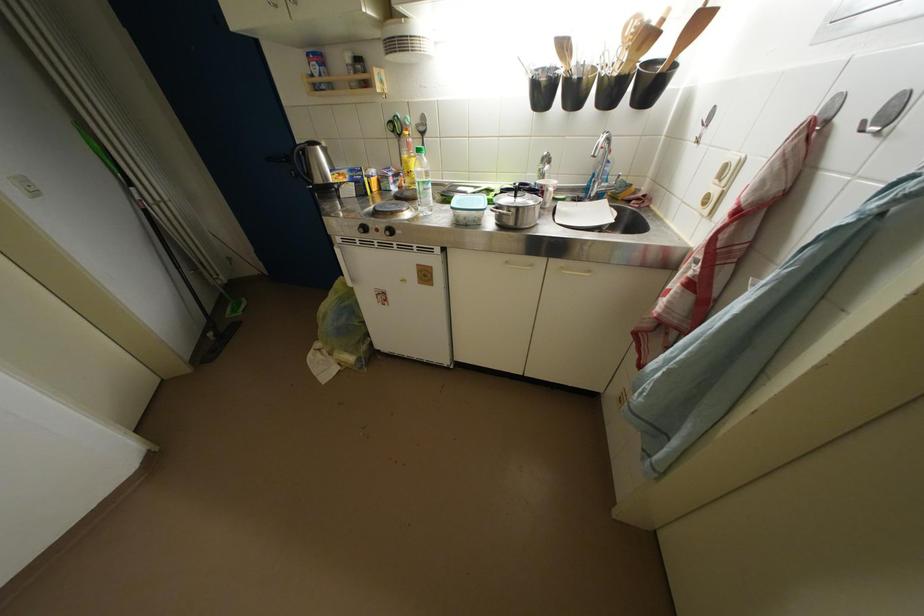
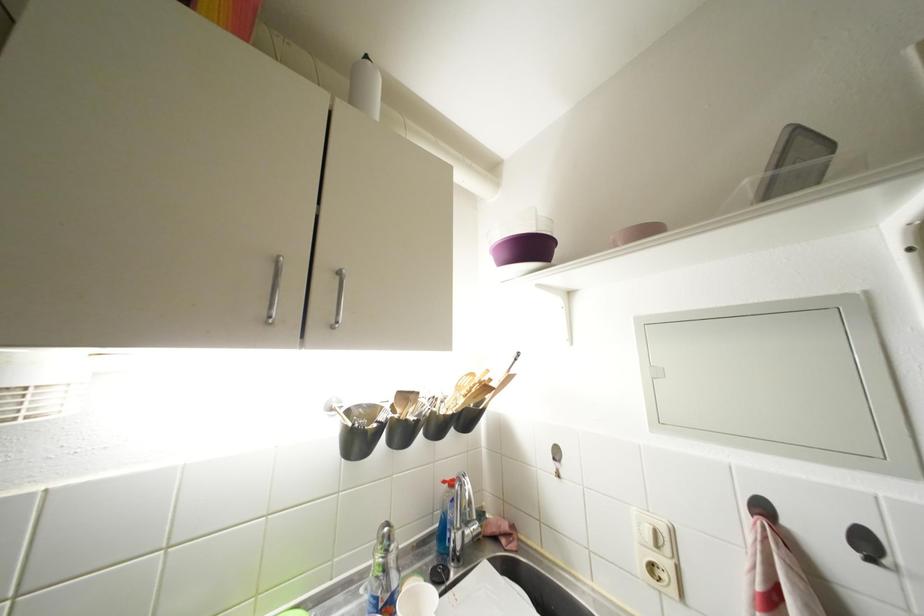
Based on the continuous images, in which direction is the camera rotating?

Answer: The rotation direction of the camera is right-up.